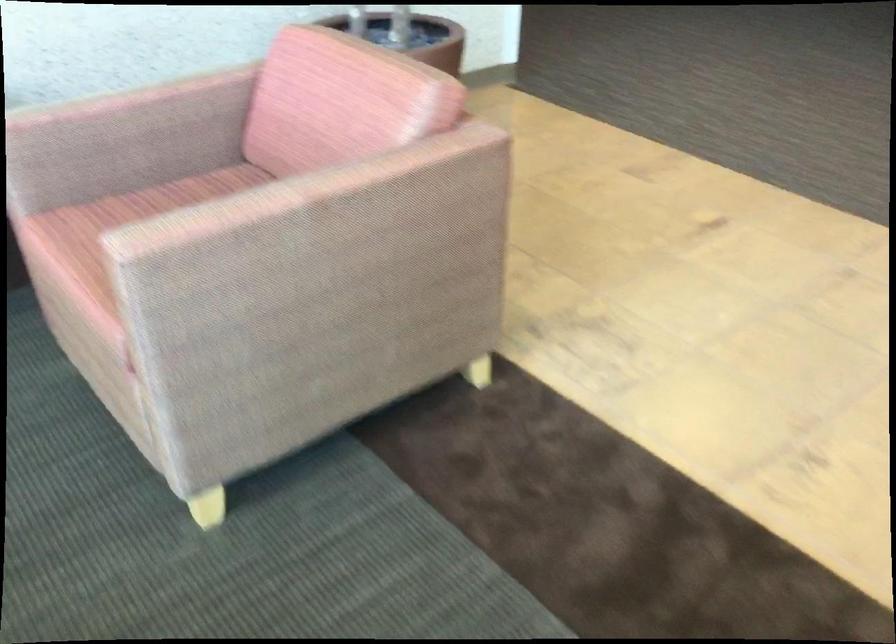
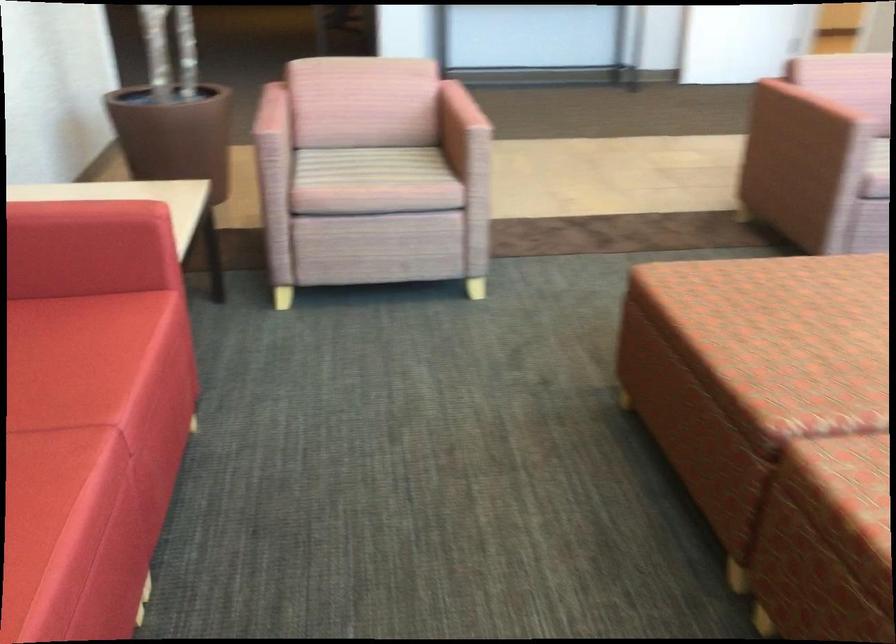
Locate, in the second image, the point that corresponds to (x=89, y=100) in the first image.

(271, 113)